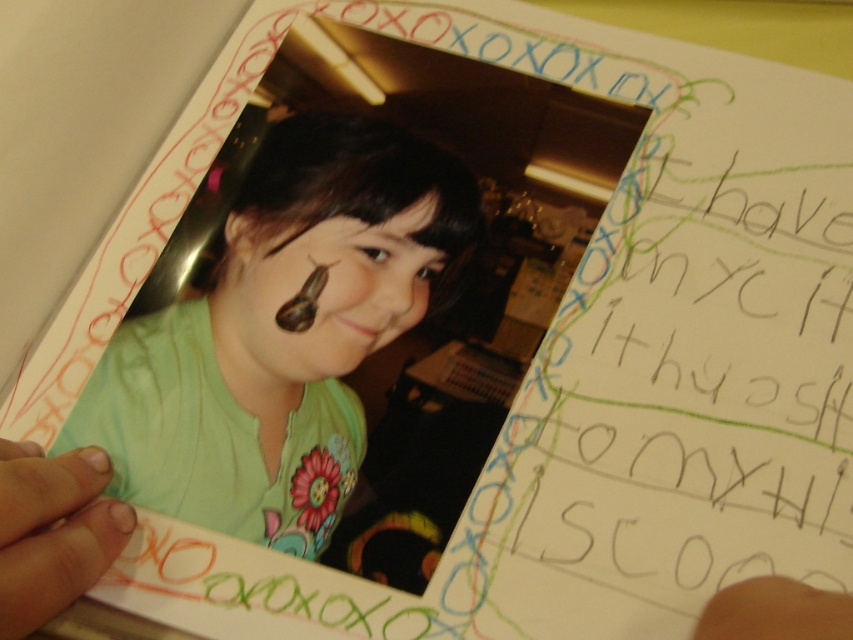
Question: Is green matte shirt at center above brown shiny snail at center?

Choices:
 (A) no
 (B) yes

Answer: (A)

Question: Among these objects, which one is farthest from the camera?

Choices:
 (A) green matte shirt at center
 (B) brown shiny snail at center

Answer: (B)

Question: Where is green matte shirt at center located in relation to brown shiny snail at center in the image?

Choices:
 (A) right
 (B) left

Answer: (B)

Question: Can you confirm if green matte shirt at center is smaller than brown shiny snail at center?

Choices:
 (A) yes
 (B) no

Answer: (B)